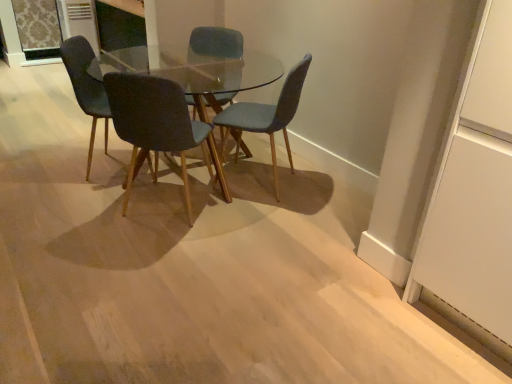
Question: Is textured blue chair at center, arranged as the 1th chair when viewed from the right, smaller than transparent glass door at upper right?

Choices:
 (A) yes
 (B) no

Answer: (A)

Question: Is textured blue chair at center, arranged as the 1th chair when viewed from the right, thinner than transparent glass door at upper right?

Choices:
 (A) yes
 (B) no

Answer: (A)

Question: Is textured blue chair at center, acting as the fourth chair starting from the left, to the right of transparent glass door at upper right from the viewer's perspective?

Choices:
 (A) no
 (B) yes

Answer: (A)

Question: From a real-world perspective, is textured blue chair at center, arranged as the 1th chair when viewed from the right, over transparent glass door at upper right?

Choices:
 (A) no
 (B) yes

Answer: (A)

Question: Is textured blue chair at center, acting as the fourth chair starting from the left, positioned before transparent glass door at upper right?

Choices:
 (A) yes
 (B) no

Answer: (B)

Question: In terms of width, does transparent glass door at upper right look wider or thinner when compared to matte blue chair at center, which is the first chair in left-to-right order?

Choices:
 (A) wide
 (B) thin

Answer: (A)

Question: From their relative heights in the image, would you say transparent glass door at upper right is taller or shorter than matte blue chair at center, which is the first chair in left-to-right order?

Choices:
 (A) short
 (B) tall

Answer: (B)

Question: From a real-world perspective, is transparent glass door at upper right above or below matte blue chair at center, positioned as the fourth chair in right-to-left order?

Choices:
 (A) below
 (B) above

Answer: (B)

Question: Is transparent glass door at upper right situated inside matte blue chair at center, which is the first chair in left-to-right order, or outside?

Choices:
 (A) inside
 (B) outside

Answer: (B)

Question: In the image, is matte blue chair at center, placed as the third chair when sorted from left to right, on the left side or the right side of textured blue chair at center, arranged as the 1th chair when viewed from the right?

Choices:
 (A) left
 (B) right

Answer: (A)

Question: Is matte blue chair at center, placed as the third chair when sorted from left to right, wider or thinner than textured blue chair at center, acting as the fourth chair starting from the left?

Choices:
 (A) thin
 (B) wide

Answer: (B)

Question: Is matte blue chair at center, the 2th chair positioned from the right, spatially inside textured blue chair at center, acting as the fourth chair starting from the left, or outside of it?

Choices:
 (A) inside
 (B) outside

Answer: (B)

Question: Relative to textured blue chair at center, acting as the fourth chair starting from the left, is matte blue chair at center, the 2th chair positioned from the right, in front or behind?

Choices:
 (A) front
 (B) behind

Answer: (B)

Question: From a real-world perspective, relative to matte blue chair at center, placed as the third chair when sorted from left to right, is dark gray fabric chair at center, which appears as the third chair when viewed from the right, vertically above or below?

Choices:
 (A) above
 (B) below

Answer: (B)

Question: In the image, is dark gray fabric chair at center, the 2th chair positioned from the left, on the left side or the right side of matte blue chair at center, the 2th chair positioned from the right?

Choices:
 (A) right
 (B) left

Answer: (B)